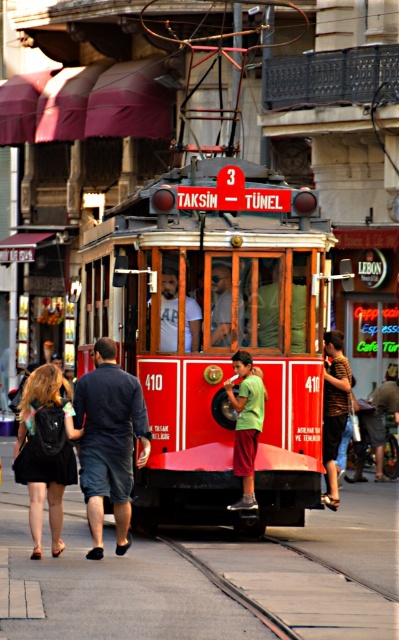
Can you confirm if dark blue denim shorts at center is taller than black backpack at lower left?

Correct, dark blue denim shorts at center is much taller as black backpack at lower left.

Based on the photo, is dark blue denim shorts at center positioned in front of black backpack at lower left?

No, dark blue denim shorts at center is behind black backpack at lower left.

Which is behind, point (130, 516) or point (27, 428)?

The point (130, 516) is more distant.

You are a GUI agent. You are given a task and a screenshot of the screen. Output one action in this format:
    pyautogui.click(x=<x>, y=<y>)
    Task: Click on the dark blue denim shorts at center
    Image resolution: width=399 pixels, height=640 pixels.
    Given the screenshot: What is the action you would take?
    coord(108,442)

Who is more distant from viewer, (246,369) or (343,396)?

The point (343,396) is more distant.

Measure the distance between green matte shirt at center and camera.

green matte shirt at center is 14.95 meters away from camera.

Where is `green matte shirt at center`? The height and width of the screenshot is (640, 399). green matte shirt at center is located at coordinates (246, 422).

Is red polished wood tram at center taller than green matte shirt at center?

In fact, red polished wood tram at center may be shorter than green matte shirt at center.

Which is more to the right, red polished wood tram at center or green matte shirt at center?

green matte shirt at center is more to the right.

What are the coordinates of `red polished wood tram at center` in the screenshot? It's located at (217, 333).

This screenshot has height=640, width=399. Find the location of `red polished wood tram at center`. red polished wood tram at center is located at coordinates (217, 333).